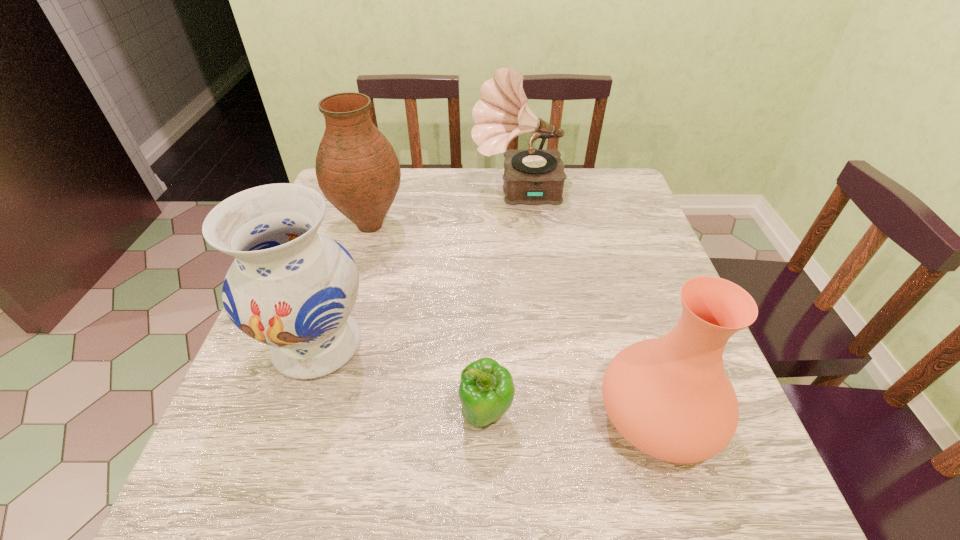
Find the location of `record player that is positioned at the far edge`. record player that is positioned at the far edge is located at coordinates (532, 176).

The height and width of the screenshot is (540, 960). I want to click on vase situated at the far edge, so click(x=357, y=169).

The height and width of the screenshot is (540, 960). What are the coordinates of `object located in the near edge section of the desktop` in the screenshot? It's located at (670, 397).

This screenshot has width=960, height=540. In order to click on object located at the right edge in this screenshot , I will do `click(670, 397)`.

This screenshot has height=540, width=960. In order to click on object positioned at the far left corner in this screenshot , I will do [357, 169].

Locate an element on the screen. object that is positioned at the near right corner is located at coordinates (670, 397).

Where is `free spot at the far edge of the desktop`? The width and height of the screenshot is (960, 540). free spot at the far edge of the desktop is located at coordinates (479, 212).

What are the coordinates of `free region at the near edge` in the screenshot? It's located at (527, 476).

Where is `vacant space at the left edge of the desktop`? vacant space at the left edge of the desktop is located at coordinates (310, 379).

Where is `free spot at the right edge of the desktop`? free spot at the right edge of the desktop is located at coordinates (628, 250).